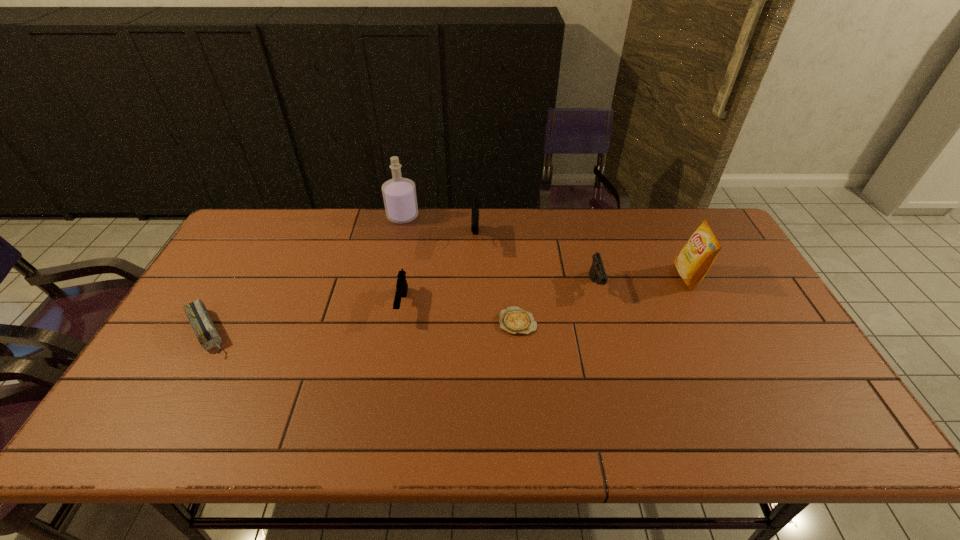
This screenshot has height=540, width=960. Identify the location of free space between the leftmost pistol and the shortest object. (460, 313).

The image size is (960, 540). Identify the location of vacant area between the rightmost pistol and the leftmost pistol. (499, 295).

Image resolution: width=960 pixels, height=540 pixels. What are the coordinates of `vacant area that lies between the quiche and the sixth tallest object` in the screenshot? It's located at (363, 327).

Find the location of a particular element. This screenshot has width=960, height=540. unoccupied area between the quiche and the second pistol from left to right is located at coordinates (496, 281).

Where is `free spot between the leftmost object and the shortest object`? free spot between the leftmost object and the shortest object is located at coordinates (363, 327).

At what (x,y) coordinates should I click in order to perform the action: click on vacant space that is in between the tallest pistol and the perfume. Please return your answer as a coordinate pair (x, y). Looking at the image, I should click on (439, 228).

Locate an element on the screen. The width and height of the screenshot is (960, 540). free spot between the second object from right to left and the leftmost pistol is located at coordinates (499, 295).

At what (x,y) coordinates should I click in order to perform the action: click on vacant space that is in between the quiche and the rightmost object. Please return your answer as a coordinate pair (x, y). Looking at the image, I should click on (603, 299).

Image resolution: width=960 pixels, height=540 pixels. Find the location of `free space between the rightmost object and the sixth tallest object`. free space between the rightmost object and the sixth tallest object is located at coordinates (447, 305).

I want to click on object identified as the second closest to the fifth object from left to right, so click(475, 203).